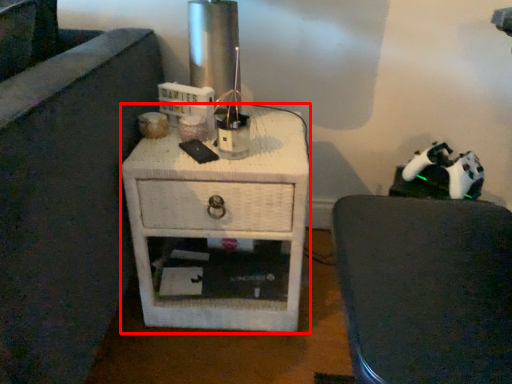
Question: From the image's perspective, where is nightstand (annotated by the red box) located in relation to furniture in the image?

Choices:
 (A) above
 (B) below

Answer: (A)